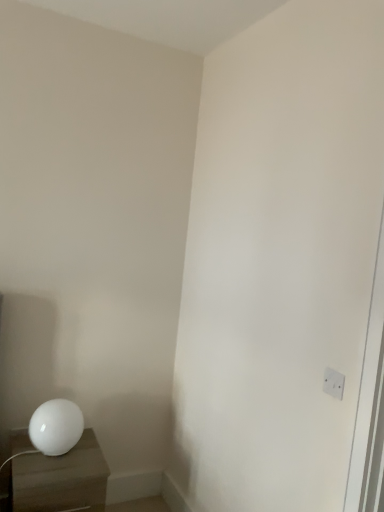
Question: Is white glossy nightstand at lower left positioned before white plastic electric outlet at upper right?

Choices:
 (A) no
 (B) yes

Answer: (A)

Question: Is white glossy nightstand at lower left taller than white plastic electric outlet at upper right?

Choices:
 (A) yes
 (B) no

Answer: (A)

Question: Is white glossy nightstand at lower left to the right of white plastic electric outlet at upper right from the viewer's perspective?

Choices:
 (A) yes
 (B) no

Answer: (B)

Question: Is white glossy nightstand at lower left next to white plastic electric outlet at upper right?

Choices:
 (A) yes
 (B) no

Answer: (B)

Question: Is white glossy nightstand at lower left looking in the opposite direction of white plastic electric outlet at upper right?

Choices:
 (A) yes
 (B) no

Answer: (B)

Question: Is the depth of white glossy nightstand at lower left greater than that of white plastic electric outlet at upper right?

Choices:
 (A) yes
 (B) no

Answer: (A)

Question: Can you confirm if white glossy sphere at lower left is shorter than white glossy nightstand at lower left?

Choices:
 (A) no
 (B) yes

Answer: (B)

Question: Considering the relative positions of white glossy sphere at lower left and white glossy nightstand at lower left in the image provided, is white glossy sphere at lower left behind white glossy nightstand at lower left?

Choices:
 (A) no
 (B) yes

Answer: (B)

Question: Considering the relative positions of white glossy sphere at lower left and white glossy nightstand at lower left in the image provided, is white glossy sphere at lower left to the left of white glossy nightstand at lower left from the viewer's perspective?

Choices:
 (A) no
 (B) yes

Answer: (A)

Question: Is white glossy sphere at lower left smaller than white glossy nightstand at lower left?

Choices:
 (A) yes
 (B) no

Answer: (A)

Question: From a real-world perspective, is white glossy sphere at lower left physically below white glossy nightstand at lower left?

Choices:
 (A) yes
 (B) no

Answer: (B)

Question: Is white glossy nightstand at lower left a part of white glossy sphere at lower left?

Choices:
 (A) no
 (B) yes

Answer: (A)

Question: Considering the relative positions of white plastic electric outlet at upper right and white glossy sphere at lower left in the image provided, is white plastic electric outlet at upper right behind white glossy sphere at lower left?

Choices:
 (A) no
 (B) yes

Answer: (A)